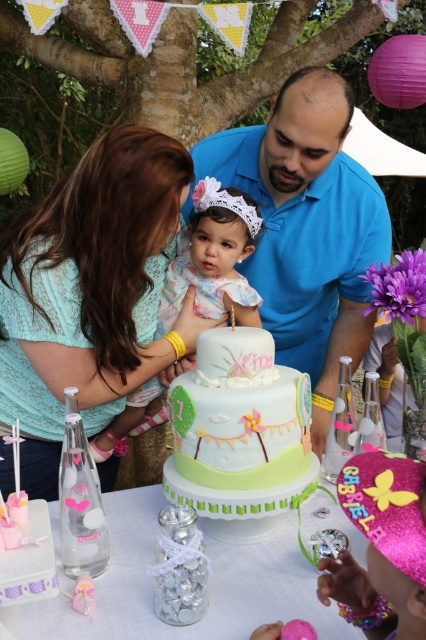
You are a guest at Nina s birthday party and you see the blue smooth shirt at center and the matte green cake at center. Which object is higher in the image?

The blue smooth shirt at center is higher than the matte green cake at center.

You are at a birthday party and see the pastel fondant cake at center and the matte green cake at center. Which cake is located to the right?

The pastel fondant cake at center is located to the right of the matte green cake at center.

You are planning to take a photo of the matte teal lace dress at upper left and the pastel floral dress at center for a fashion blog. The camera you have can only focus on objects within a 10 inch range. Will both dresses fit within the camera focus range?

The matte teal lace dress at upper left and pastel floral dress at center are 8.57 inches apart from each other, so yes, both dresses will fit within the camera focus range since the distance between them is less than 10 inches.